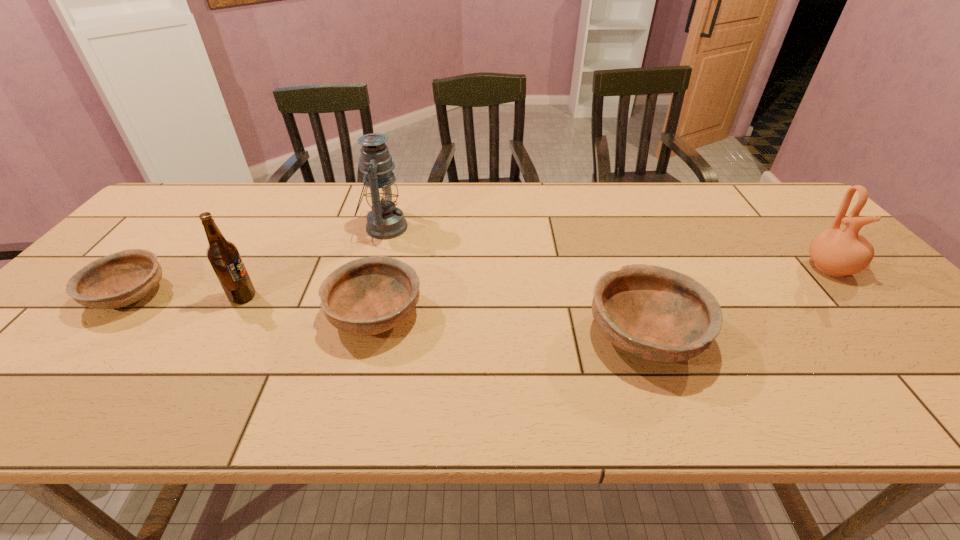
I want to click on vacant space located 0.260m on the right of the second shortest bowl, so (x=532, y=314).

The image size is (960, 540). In order to click on vacant space located on the right of the fifth object from left to right in this screenshot , I will do `click(853, 335)`.

At what (x,y) coordinates should I click in order to perform the action: click on vacant space located 0.130m on the front-facing side of the farthest object. Please return your answer as a coordinate pair (x, y). This screenshot has height=540, width=960. Looking at the image, I should click on (451, 227).

At what (x,y) coordinates should I click in order to perform the action: click on vacant area situated on the spout of the rightmost object. Please return your answer as a coordinate pair (x, y). Image resolution: width=960 pixels, height=540 pixels. Looking at the image, I should click on (925, 370).

At what (x,y) coordinates should I click in order to perform the action: click on vacant point located on the label of the beer bottle. Please return your answer as a coordinate pair (x, y). Image resolution: width=960 pixels, height=540 pixels. Looking at the image, I should click on (332, 297).

Locate an element on the screen. object present at the far edge is located at coordinates (385, 221).

Image resolution: width=960 pixels, height=540 pixels. I want to click on object situated at the left edge, so point(122,278).

Where is `object located at the right edge`? object located at the right edge is located at coordinates (836, 252).

Where is `blank space at the far edge of the desktop`? blank space at the far edge of the desktop is located at coordinates (563, 185).

Where is `vacant region at the near edge of the desktop`? vacant region at the near edge of the desktop is located at coordinates (805, 347).